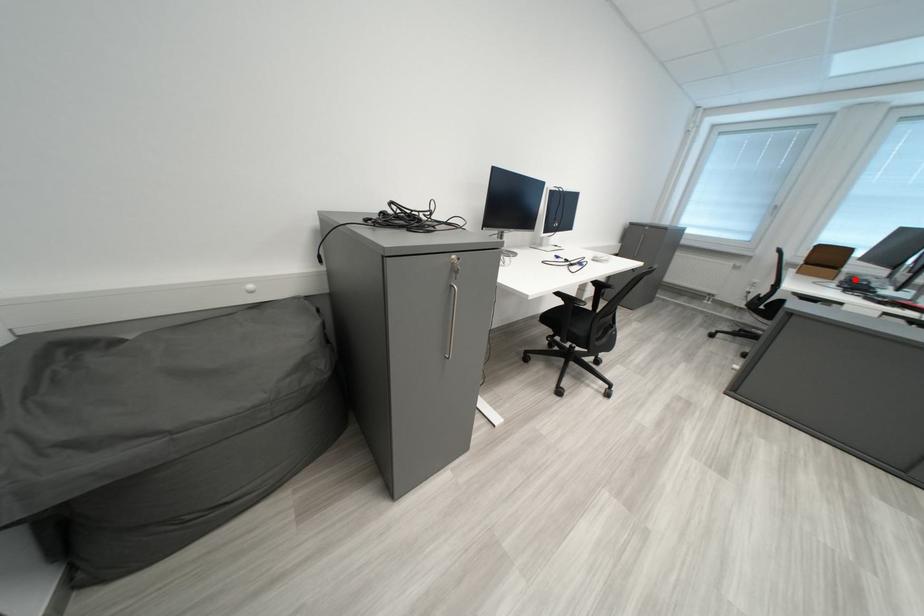
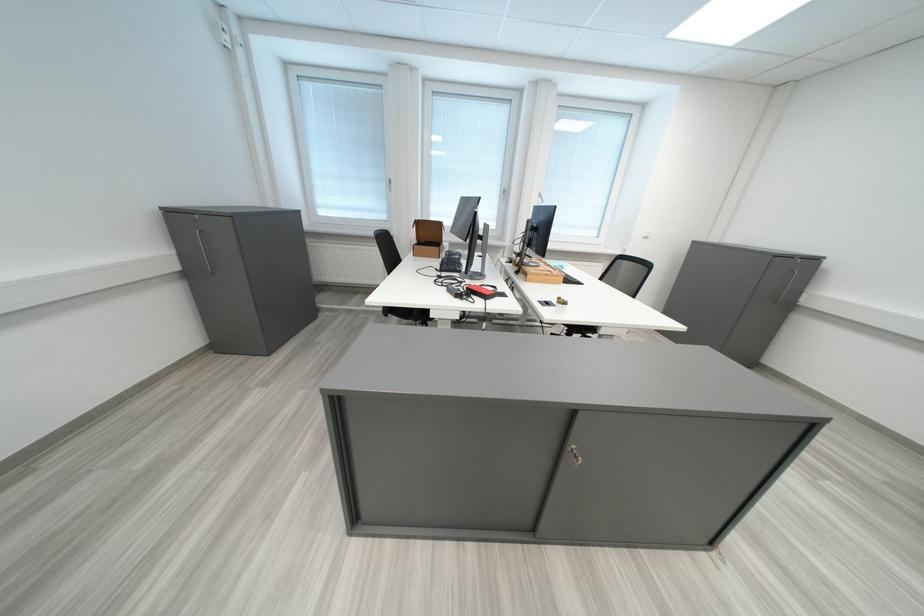
The point at the highlighted location is marked in the first image. Where is the corresponding point in the second image?

(456, 256)